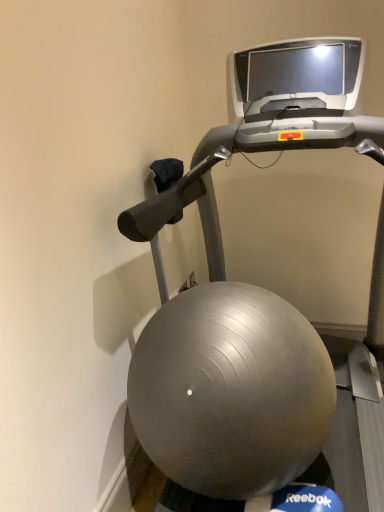
Question: Should I look upward or downward to see silver metallic treadmill at center?

Choices:
 (A) up
 (B) down

Answer: (B)